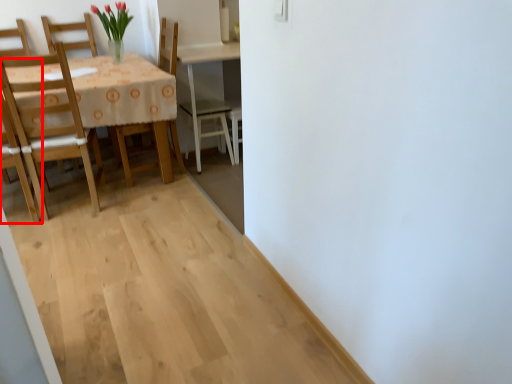
Question: From the image's perspective, considering the relative positions of chair (annotated by the red box) and chair in the image provided, where is chair (annotated by the red box) located with respect to the staircase?

Choices:
 (A) below
 (B) above

Answer: (A)